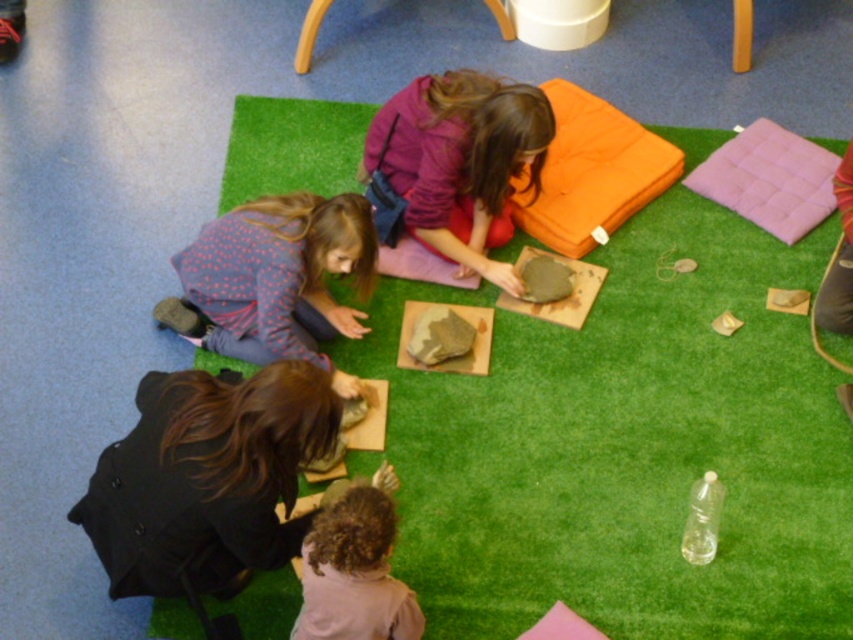
Question: Which object is farther from the camera taking this photo?

Choices:
 (A) matte purple sweater at center
 (B) orange fabric cushion at upper center

Answer: (B)

Question: Is orange fabric cushion at upper center above pink fabric cushion at upper right?

Choices:
 (A) no
 (B) yes

Answer: (B)

Question: Which object is closer to the camera taking this photo?

Choices:
 (A) matte purple sweater at center
 (B) orange fabric cushion at upper center
 (C) rough stone at center
 (D) pink fabric cushion at upper right

Answer: (A)

Question: Does pink fabric cushion at upper right have a smaller size compared to rough stone at center?

Choices:
 (A) yes
 (B) no

Answer: (B)

Question: Is orange fabric cushion at upper center positioned at the back of rough stone at center?

Choices:
 (A) yes
 (B) no

Answer: (A)

Question: Based on their relative distances, which object is nearer to the matte purple sweater at center?

Choices:
 (A) pink fabric cushion at upper right
 (B) orange fabric cushion at upper center
 (C) polka dot fabric shirt at lower left

Answer: (B)